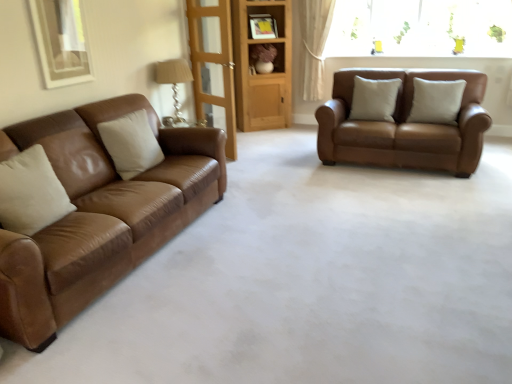
Measure the distance between point (313, 74) and camera.

The depth of point (313, 74) is 6.34 meters.

What is the approximate width of transparent glass window at upper right?

It is 10.78 inches.

This screenshot has height=384, width=512. What do you see at coordinates (421, 27) in the screenshot? I see `transparent glass window at upper right` at bounding box center [421, 27].

At what (x,y) coordinates should I click in order to perform the action: click on matte brown shelf at center. Please return your answer as a coordinate pair (x, y). The width and height of the screenshot is (512, 384). Looking at the image, I should click on (266, 58).

This screenshot has width=512, height=384. I want to click on white leather pillow at left, the 3th pillow when ordered from right to left, so click(131, 144).

Are white leather pillow at left, the 3th pillow when ordered from right to left, and beige leather pillow at center, the 2th pillow from the right, making contact?

There is a gap between white leather pillow at left, the 3th pillow when ordered from right to left, and beige leather pillow at center, the 2th pillow from the right.

Image resolution: width=512 pixels, height=384 pixels. Find the location of `pillow directly beneath the beige leather pillow at center, the 1th pillow positioned from the back (from a real-world perspective)`. pillow directly beneath the beige leather pillow at center, the 1th pillow positioned from the back (from a real-world perspective) is located at coordinates click(131, 144).

From a real-world perspective, who is located higher, white leather pillow at left, the 3th pillow when ordered from right to left, or beige leather pillow at center, the 2th pillow from the right?

From a 3D spatial view, beige leather pillow at center, the 2th pillow from the right, is above.

Who is smaller, white leather pillow at left, arranged as the 1th pillow when viewed from the front, or beige leather pillow at center, the 1th pillow positioned from the back?

With smaller size is beige leather pillow at center, the 1th pillow positioned from the back.

Considering the positions of objects matte brown shelf at center and matte beige fabric lampshade at upper left in the image provided, who is in front, matte brown shelf at center or matte beige fabric lampshade at upper left?

matte beige fabric lampshade at upper left is more forward.

Is matte brown shelf at center spatially inside matte beige fabric lampshade at upper left, or outside of it?

The correct answer is: outside.

In the image, is matte brown shelf at center on the left side or the right side of matte beige fabric lampshade at upper left?

In the image, matte brown shelf at center appears on the right side of matte beige fabric lampshade at upper left.

Between matte brown shelf at center and matte beige fabric lampshade at upper left, which one has smaller width?

Thinner between the two is matte beige fabric lampshade at upper left.

From a real-world perspective, is matte beige fabric lampshade at upper left located beneath transparent glass door at center?

Yes, from a real-world perspective, matte beige fabric lampshade at upper left is beneath transparent glass door at center.

Measure the distance from matte beige fabric lampshade at upper left to transparent glass door at center.

matte beige fabric lampshade at upper left is 16.27 inches from transparent glass door at center.

How many degrees apart are the facing directions of matte beige fabric lampshade at upper left and transparent glass door at center?

123 degrees.

Is matte beige fabric lampshade at upper left oriented towards transparent glass door at center?

No, matte beige fabric lampshade at upper left does not turn towards transparent glass door at center.

From a real-world perspective, is wooden bookshelf at center positioned under saddle brown leather sofa at right, the first studio couch when ordered from right to left, based on gravity?

No, from a real-world perspective, wooden bookshelf at center is not beneath saddle brown leather sofa at right, the first studio couch when ordered from right to left.

Does wooden bookshelf at center appear on the left side of saddle brown leather sofa at right, arranged as the 2th studio couch when viewed from the front?

Indeed, wooden bookshelf at center is positioned on the left side of saddle brown leather sofa at right, arranged as the 2th studio couch when viewed from the front.

Does point (237, 43) come behind point (432, 130)?

Yes, it is.

Is wooden bookshelf at center far away from saddle brown leather sofa at right, which ranks as the first studio couch in back-to-front order?

Yes.

Would you say transparent glass window at upper right is outside saddle brown leather sofa at right, marked as the second studio couch in a left-to-right arrangement?

That's correct, transparent glass window at upper right is outside of saddle brown leather sofa at right, marked as the second studio couch in a left-to-right arrangement.

Between transparent glass window at upper right and saddle brown leather sofa at right, marked as the second studio couch in a left-to-right arrangement, which one has smaller size?

transparent glass window at upper right is smaller.

In the image, is white leather pillow at center, the 2th pillow in the back-to-front sequence, positioned in front of or behind saddle brown leather sofa at right, which ranks as the first studio couch in back-to-front order?

white leather pillow at center, the 2th pillow in the back-to-front sequence, is behind saddle brown leather sofa at right, which ranks as the first studio couch in back-to-front order.

From the image's perspective, is white leather pillow at center, acting as the first pillow starting from the right, positioned above or below saddle brown leather sofa at right, arranged as the 2th studio couch when viewed from the front?

white leather pillow at center, acting as the first pillow starting from the right, is situated higher than saddle brown leather sofa at right, arranged as the 2th studio couch when viewed from the front, in the image.

Is white leather pillow at center, the 2th pillow in the back-to-front sequence, oriented away from saddle brown leather sofa at right, which ranks as the first studio couch in back-to-front order?

Yes, white leather pillow at center, the 2th pillow in the back-to-front sequence, is facing away from saddle brown leather sofa at right, which ranks as the first studio couch in back-to-front order.

Who is taller, white leather pillow at center, the 2th pillow in the back-to-front sequence, or saddle brown leather sofa at right, arranged as the 2th studio couch when viewed from the front?

saddle brown leather sofa at right, arranged as the 2th studio couch when viewed from the front.

Are beige leather pillow at center, the 2th pillow from the right, and matte brown leather couch at left, which ranks as the first studio couch in front-to-back order, far apart?

That's right, there is a large distance between beige leather pillow at center, the 2th pillow from the right, and matte brown leather couch at left, which ranks as the first studio couch in front-to-back order.

In the scene shown: Is beige leather pillow at center, the 2th pillow positioned from the left, oriented towards matte brown leather couch at left, which appears as the first studio couch when viewed from the left?

No.

Is beige leather pillow at center, the 2th pillow positioned from the left, positioned behind matte brown leather couch at left, which ranks as the first studio couch in front-to-back order?

Yes, beige leather pillow at center, the 2th pillow positioned from the left, is behind matte brown leather couch at left, which ranks as the first studio couch in front-to-back order.

Considering the relative positions of beige leather pillow at center, the 2th pillow from the right, and matte brown leather couch at left, which is the 2th studio couch from back to front, in the image provided, is beige leather pillow at center, the 2th pillow from the right, to the left or to the right of matte brown leather couch at left, which is the 2th studio couch from back to front,?

Clearly, beige leather pillow at center, the 2th pillow from the right, is on the right of matte brown leather couch at left, which is the 2th studio couch from back to front, in the image.

This screenshot has height=384, width=512. I want to click on the 2nd pillow in front of the beige leather pillow at center, the 2th pillow from the right, starting your count from the anchor, so click(x=131, y=144).

What are the coordinates of `shelf on the right of matte beige fabric lampshade at upper left` in the screenshot? It's located at (266, 58).

Based on their spatial positions, is white leather pillow at center, acting as the first pillow starting from the right, or matte brown leather couch at left, placed as the second studio couch when sorted from right to left, closer to transparent glass window at upper right?

white leather pillow at center, acting as the first pillow starting from the right, lies closer to transparent glass window at upper right than the other object.

Based on the photo, considering their positions, is transparent glass door at center positioned further to white leather pillow at left, which is counted as the first pillow, starting from the left, than matte brown leather couch at left, which is the 2th studio couch from back to front?

transparent glass door at center lies further to white leather pillow at left, which is counted as the first pillow, starting from the left, than the other object.

Which object lies nearer to the anchor point transparent glass window at upper right, saddle brown leather sofa at right, arranged as the 2th studio couch when viewed from the front, or white leather pillow at left, which is the third pillow in back-to-front order?

saddle brown leather sofa at right, arranged as the 2th studio couch when viewed from the front.

Estimate the real-world distances between objects in this image. Which object is closer to white leather pillow at left, which is the third pillow in back-to-front order, matte brown shelf at center or white sheer curtain at upper right?

matte brown shelf at center is positioned closer to the anchor white leather pillow at left, which is the third pillow in back-to-front order.

From the image, which object appears to be nearer to matte brown shelf at center, white leather pillow at center, positioned as the third pillow in left-to-right order, or transparent glass door at center?

Based on the image, transparent glass door at center appears to be nearer to matte brown shelf at center.

In the scene shown: Considering their positions, is transparent glass window at upper right positioned closer to saddle brown leather sofa at right, marked as the second studio couch in a left-to-right arrangement, than matte beige fabric lampshade at upper left?

transparent glass window at upper right lies closer to saddle brown leather sofa at right, marked as the second studio couch in a left-to-right arrangement, than the other object.

When comparing their distances from saddle brown leather sofa at right, which ranks as the first studio couch in back-to-front order, does wooden bookshelf at center or beige leather pillow at center, the 2th pillow from the right, seem closer?

beige leather pillow at center, the 2th pillow from the right, lies closer to saddle brown leather sofa at right, which ranks as the first studio couch in back-to-front order, than the other object.

Which object lies further to the anchor point transparent glass door at center, matte beige fabric lampshade at upper left or white leather pillow at left, the 3th pillow when ordered from right to left?

white leather pillow at left, the 3th pillow when ordered from right to left, is further to transparent glass door at center.

The width and height of the screenshot is (512, 384). Identify the location of bookshelf between matte beige fabric lampshade at upper left and matte brown shelf at center in the front-back direction. (262, 74).

In order to click on lamp positioned between matte brown leather couch at left, which is the 2th studio couch from back to front, and beige leather pillow at center, positioned as the third pillow in front-to-back order, from near to far in this screenshot , I will do `click(174, 82)`.

In order to click on glass door located between white leather pillow at left, which is counted as the first pillow, starting from the left, and white leather pillow at center, positioned as the third pillow in left-to-right order, in the left-right direction in this screenshot , I will do 213,66.

This screenshot has height=384, width=512. I want to click on bookshelf located between transparent glass door at center and white leather pillow at center, the 2th pillow in the back-to-front sequence, in the left-right direction, so click(x=262, y=74).